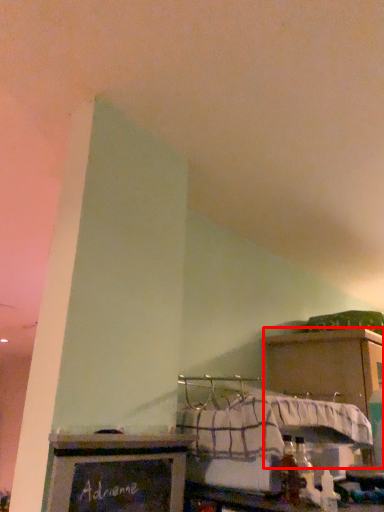
Question: From the image, what is the correct spatial relationship of cabinetry (annotated by the red box) in relation to furniture?

Choices:
 (A) left
 (B) right

Answer: (B)